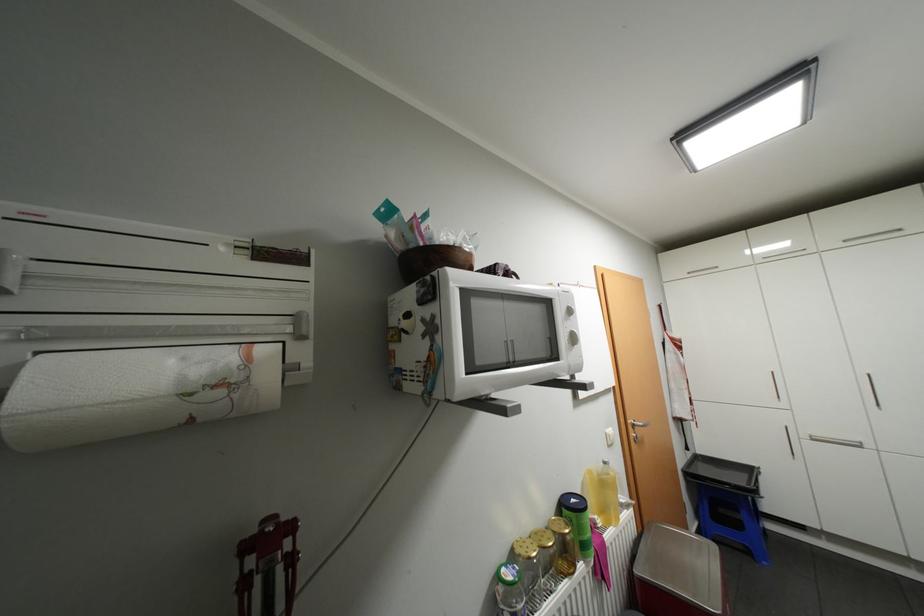
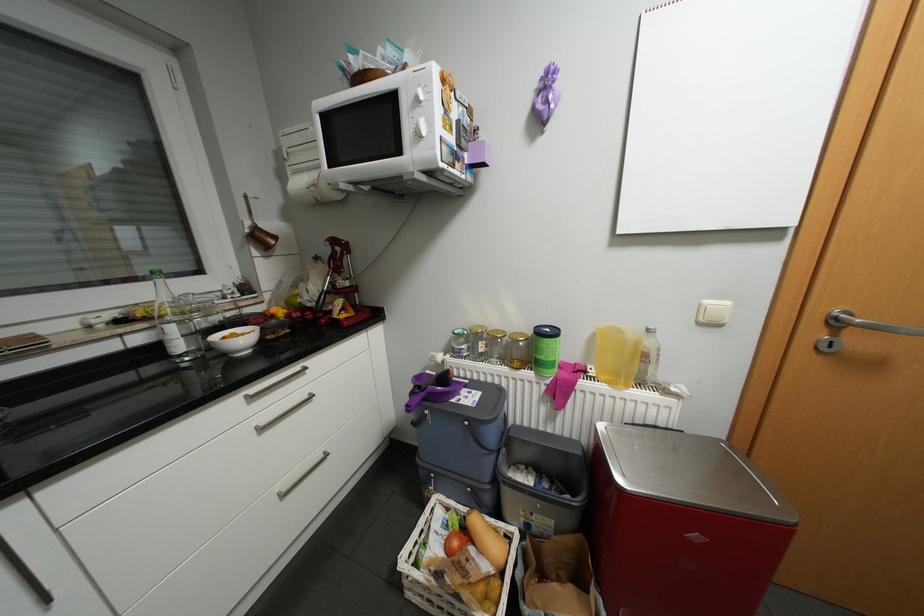
In the second image, find the point that corresponds to (592,560) in the first image.

(544, 373)